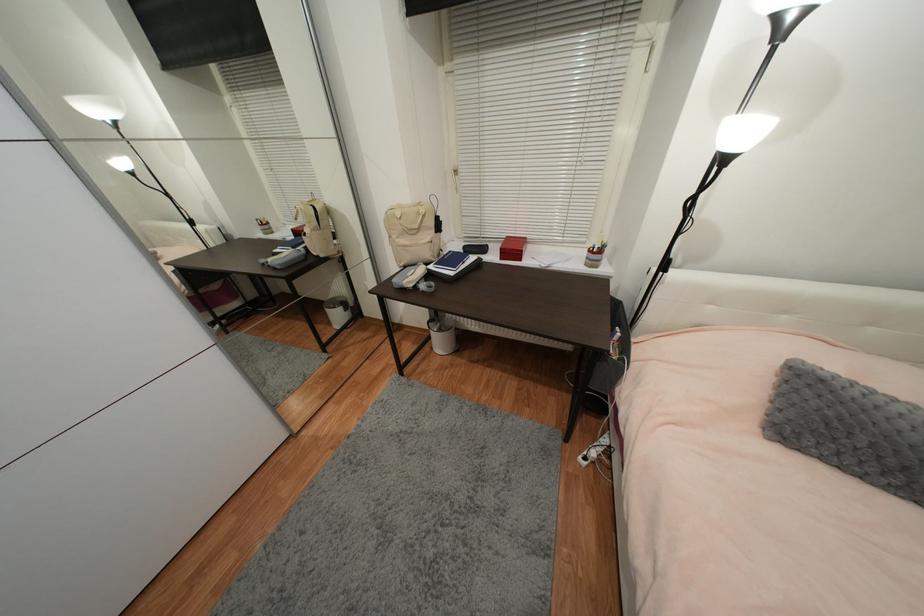
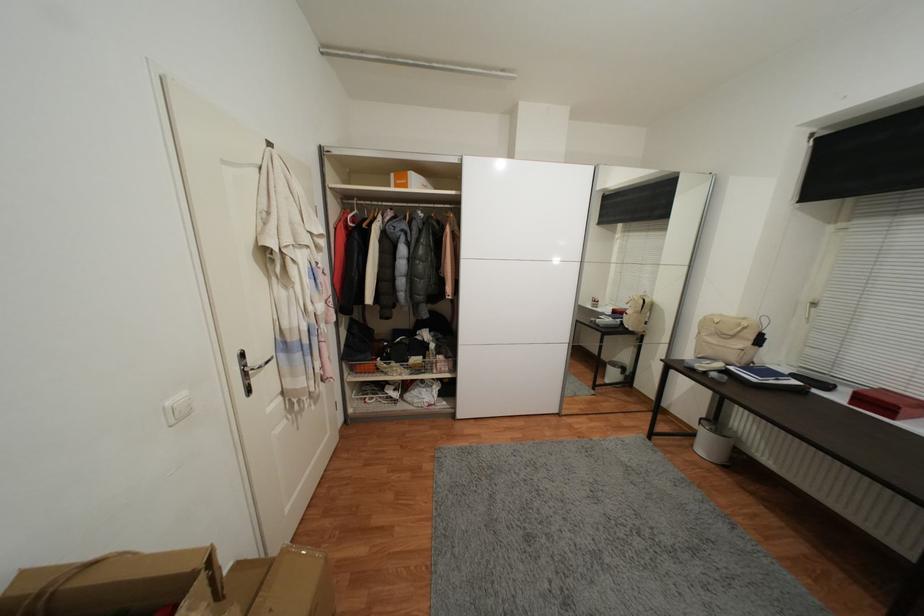
Where in the second image is the point corresponding to (x=423, y=205) from the first image?

(748, 321)